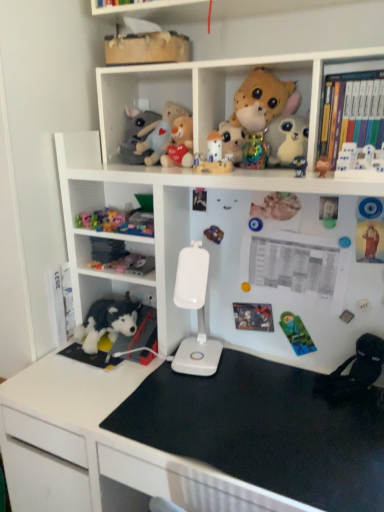
Question: Looking at the image, does white plastic lamp at center seem bigger or smaller compared to plush toy at lower left, which is the twelfth toy from top to bottom?

Choices:
 (A) big
 (B) small

Answer: (A)

Question: Is point (195, 294) closer or farther from the camera than point (105, 230)?

Choices:
 (A) farther
 (B) closer

Answer: (B)

Question: Which is nearer to the black fabric swivel chair at lower right?

Choices:
 (A) fluffy plush toy at center, placed as the 4th toy when sorted from top to bottom
 (B) plush toy at lower left, acting as the fourth toy starting from the bottom
 (C) fluffy plush toys at upper center
 (D) matte plastic toy at upper center, positioned as the 7th toy in top-to-bottom order
 (E) green fabric sleeping bag at lower right, the fifteenth toy positioned from the top

Answer: (E)

Question: Which is nearer to the matte gray plush at upper center, the thirteenth toy positioned from the bottom?

Choices:
 (A) white plastic bookcase at upper center
 (B) brown plush bear at upper right, positioned as the eighth toy in top-to-bottom order
 (C) black fabric swivel chair at lower right
 (D) fluffy plush toys at upper center
 (E) matte plastic toy at upper center, which is the 11th toy from bottom to top

Answer: (D)